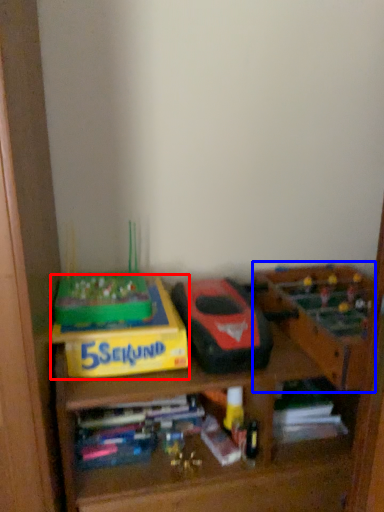
Question: Which object appears farthest to the camera in this image, cardboard box (highlighted by a red box) or toy (highlighted by a blue box)?

Choices:
 (A) cardboard box
 (B) toy

Answer: (A)